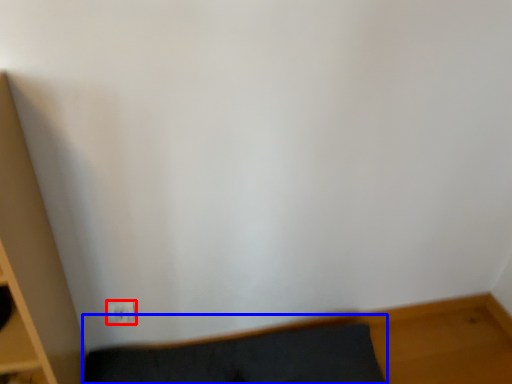
Question: Which of the following is the farthest to the observer, electric outlet (highlighted by a red box) or furniture (highlighted by a blue box)?

Choices:
 (A) electric outlet
 (B) furniture

Answer: (A)